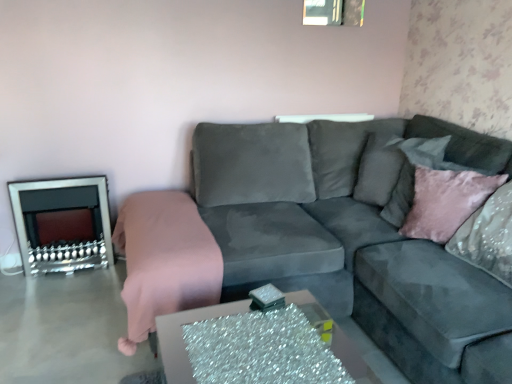
Question: Would you say pink velvet cushion at right is to the left or to the right of pink velvet blanket at left in the picture?

Choices:
 (A) left
 (B) right

Answer: (B)

Question: From the image's perspective, is pink velvet cushion at right located above or below pink velvet blanket at left?

Choices:
 (A) above
 (B) below

Answer: (A)

Question: Estimate the real-world distances between objects in this image. Which object is farther from the velvet gray pillow at upper right?

Choices:
 (A) velvet gray couch at center
 (B) pink velvet blanket at left
 (C) pink velvet cushion at right
 (D) sparkly silver table at center
 (E) silver metallic fireplace at left

Answer: (E)

Question: Estimate the real-world distances between objects in this image. Which object is closer to the pink velvet blanket at left?

Choices:
 (A) velvet gray pillow at upper right
 (B) sparkly silver table at center
 (C) velvet gray couch at center
 (D) pink velvet cushion at right
 (E) silver metallic fireplace at left

Answer: (C)